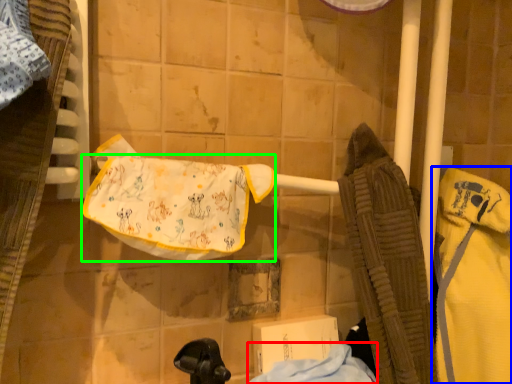
Question: Based on their relative distances, which object is nearer to cloth (highlighted by a red box)? Choose from bathrobe (highlighted by a blue box) and underclothes (highlighted by a green box).

Choices:
 (A) bathrobe
 (B) underclothes

Answer: (A)